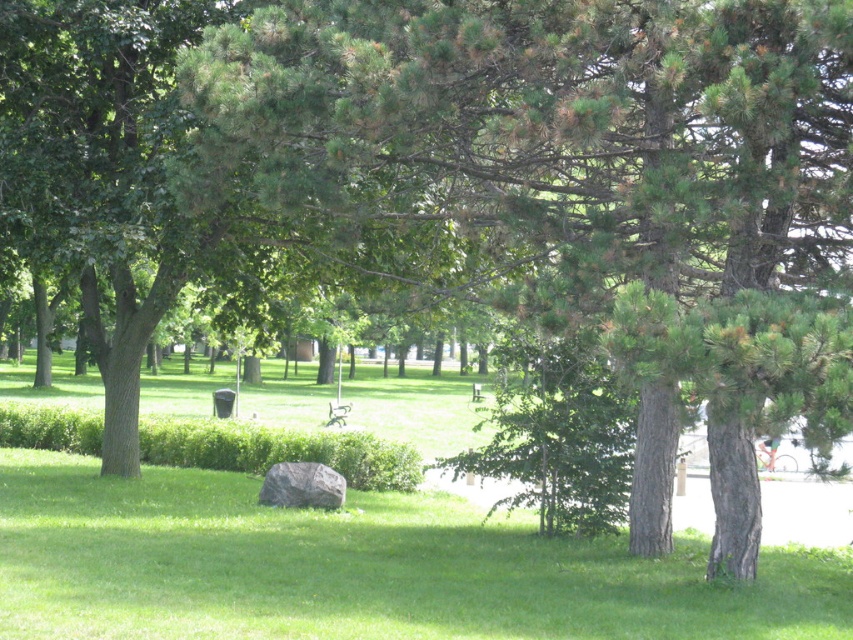
Can you confirm if gray rough boulder at center is taller than wooden park bench at center?

Indeed, gray rough boulder at center has a greater height compared to wooden park bench at center.

Between gray rough boulder at center and wooden park bench at center, which one appears on the left side from the viewer's perspective?

wooden park bench at center is more to the left.

Locate an element on the screen. gray rough boulder at center is located at coordinates (302, 486).

At what (x,y) coordinates should I click in order to perform the action: click on gray rough boulder at center. Please return your answer as a coordinate pair (x, y). The image size is (853, 640). Looking at the image, I should click on (302, 486).

Does green textured tree at center have a greater height compared to gray rough boulder at center?

In fact, green textured tree at center may be shorter than gray rough boulder at center.

Which is more to the right, green textured tree at center or gray rough boulder at center?

Positioned to the right is green textured tree at center.

Is point (263, 147) positioned in front of point (321, 486)?

Yes, it is.

The width and height of the screenshot is (853, 640). In order to click on green textured tree at center in this screenshot , I will do `click(584, 188)`.

The height and width of the screenshot is (640, 853). What do you see at coordinates (584, 188) in the screenshot?
I see `green textured tree at center` at bounding box center [584, 188].

In the scene shown: Is green textured tree at center to the left of wooden park bench at center from the viewer's perspective?

Incorrect, green textured tree at center is not on the left side of wooden park bench at center.

Where is `green textured tree at center`? The image size is (853, 640). green textured tree at center is located at coordinates (584, 188).

Where is `green textured tree at center`? green textured tree at center is located at coordinates (584, 188).